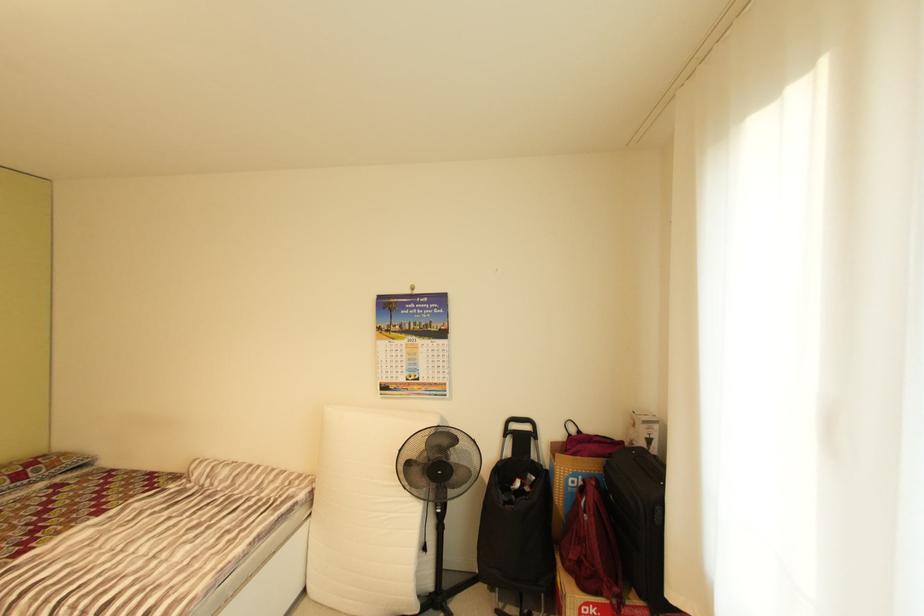
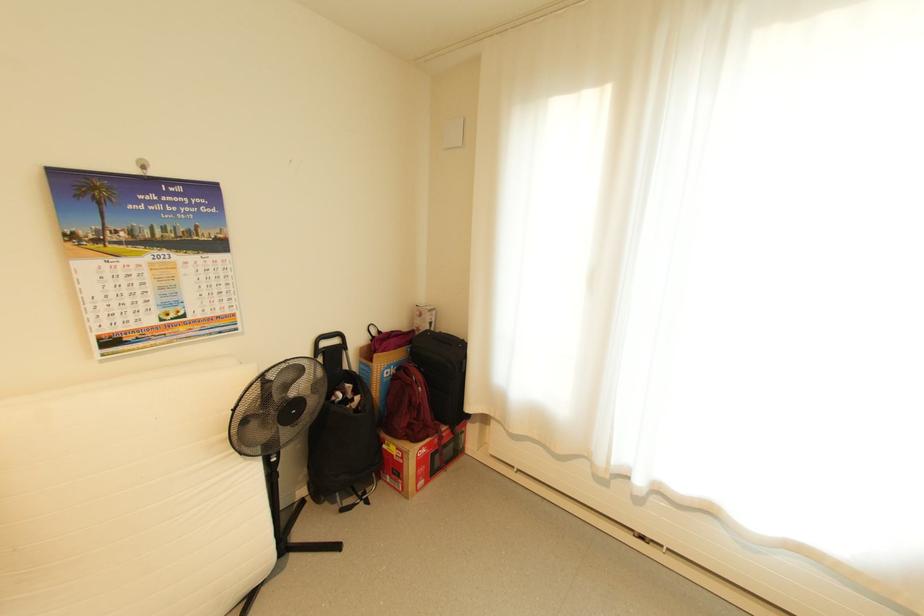
Locate, in the second image, the point that corresponds to (642,445) in the first image.

(429, 330)